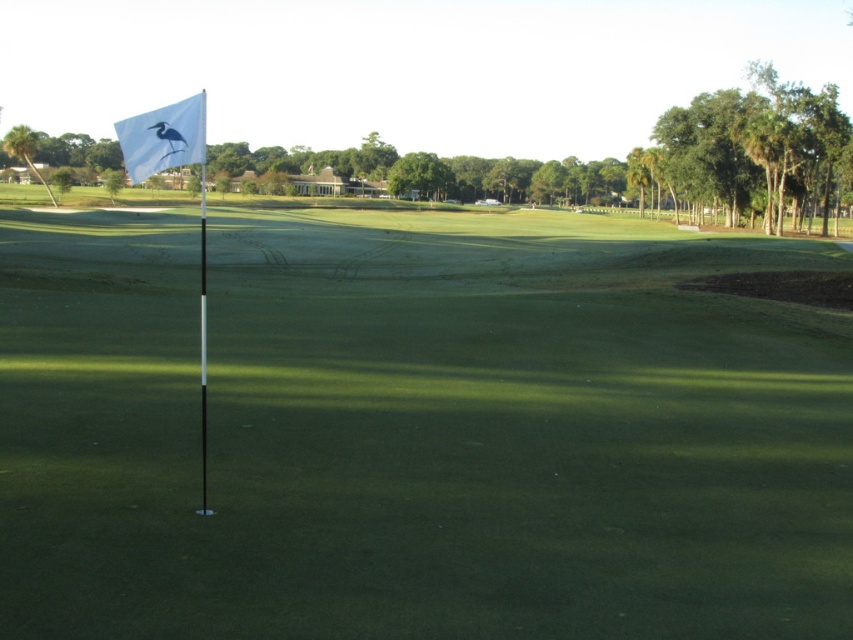
You are a golfer trying to hit the ball into the hole marked by the white plastic flag at upper left and the white fabric flag at upper left. Which flag is closer to the ground?

The white fabric flag at upper left is closer to the ground because the white plastic flag at upper left is taller than it.